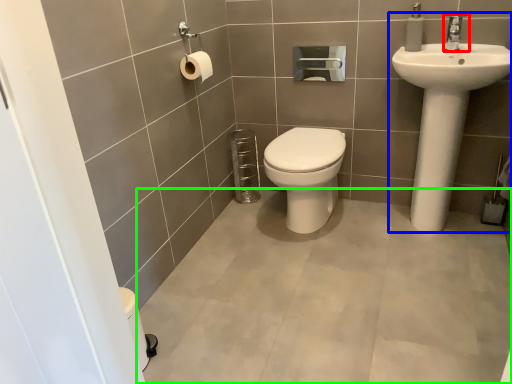
Question: Based on their relative distances, which object is nearer to tap (highlighted by a red box)? Choose from sink (highlighted by a blue box) and plain (highlighted by a green box).

Choices:
 (A) sink
 (B) plain

Answer: (A)